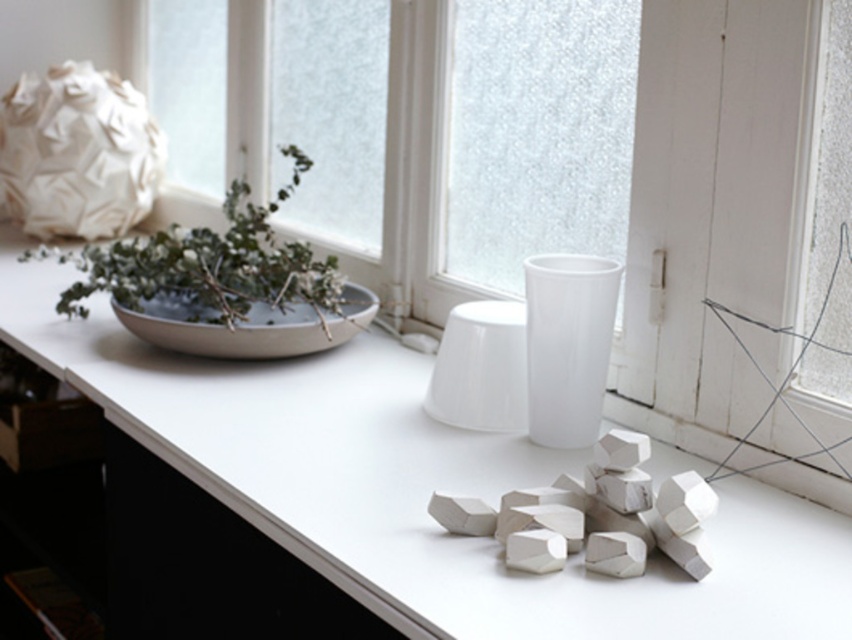
Between white matte counter top at center and matte gray bowl at center-left, which one has more height?

white matte counter top at center

Is point (266, 428) farther from camera compared to point (142, 326)?

No, (266, 428) is in front of (142, 326).

Does point (199, 406) come closer to viewer compared to point (341, 333)?

Yes, point (199, 406) is closer to viewer.

Image resolution: width=852 pixels, height=640 pixels. I want to click on white matte counter top at center, so click(417, 486).

Is transparent glass window at upper center to the right of green leafy plant at upper left from the viewer's perspective?

Indeed, transparent glass window at upper center is positioned on the right side of green leafy plant at upper left.

This screenshot has width=852, height=640. What do you see at coordinates (426, 125) in the screenshot?
I see `transparent glass window at upper center` at bounding box center [426, 125].

Find the location of a particular element. The width and height of the screenshot is (852, 640). transparent glass window at upper center is located at coordinates (426, 125).

Can you confirm if white matte counter top at center is positioned above transparent glass window at upper center?

Incorrect, white matte counter top at center is not positioned above transparent glass window at upper center.

Who is positioned more to the left, white matte counter top at center or transparent glass window at upper center?

From the viewer's perspective, white matte counter top at center appears more on the left side.

Does point (315, 392) lie behind point (436, 125)?

No.

You are a GUI agent. You are given a task and a screenshot of the screen. Output one action in this format:
    pyautogui.click(x=<x>, y=<y>)
    Task: Click on the white matte counter top at center
    The image size is (852, 640).
    Given the screenshot: What is the action you would take?
    pyautogui.click(x=417, y=486)